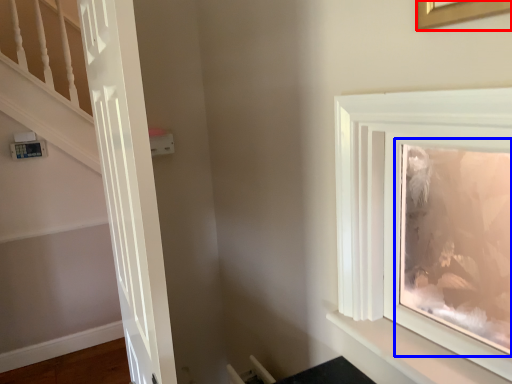
Question: Which object appears farthest to the camera in this image, picture frame (highlighted by a red box) or picture frame (highlighted by a blue box)?

Choices:
 (A) picture frame
 (B) picture frame

Answer: (B)